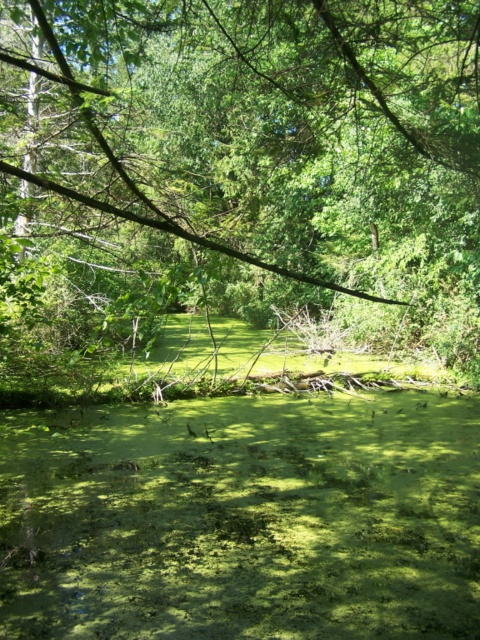
You are a hiker trying to cross the forest. You see a green leafy tree at center and green algae at center. Which one is bigger in size?

The green leafy tree at center is larger in size than green algae at center.

Looking at this image, you are a hiker who needs to cross the forest to reach a campsite. You see a green leafy tree at center and green algae at center. Which one is closer to your current position?

The green algae at center is closer to your current position because the distance between the green leafy tree at center and the green algae at center is 14.67 meters, implying the algae is nearer.

In the scene shown: You are standing in the forest and want to reach a clearing 5 meters ahead. There is a green leafy tree at center blocking your path. Can you go around it without crossing the algae covered water?

The green leafy tree at center is 3.07 meters away from you. Since the clearing is 5 meters ahead, you can go around the tree by moving either to the left or right of it, as the distance to the clearing is greater than the distance to the tree, allowing enough space to maneuver around it without needing to cross the algae covered water.